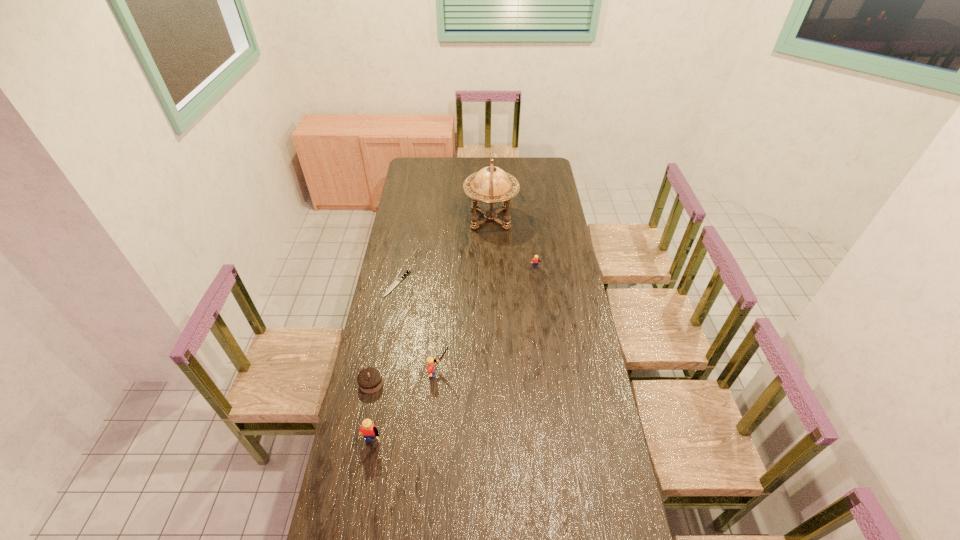
Identify the location of vacant spot for a new Lego to ensure equal spacing. (492, 316).